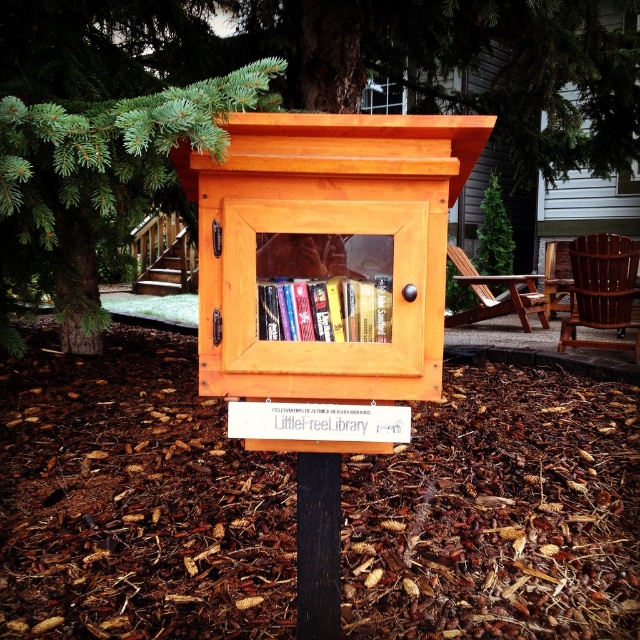
Looking at this image, can you confirm if green pine tree at upper center is smaller than hardcover books at center?

Actually, green pine tree at upper center might be larger than hardcover books at center.

Does green pine tree at upper center appear under hardcover books at center?

Actually, green pine tree at upper center is above hardcover books at center.

At what (x,y) coordinates should I click in order to perform the action: click on green pine tree at upper center. Please return your answer as a coordinate pair (x, y). Looking at the image, I should click on (266, 100).

This screenshot has height=640, width=640. Find the location of `green pine tree at upper center`. green pine tree at upper center is located at coordinates (266, 100).

Between green pine tree at upper center and black wood post at center, which one appears on the left side from the viewer's perspective?

black wood post at center

Which is behind, point (417, 19) or point (308, 532)?

Point (417, 19)

Which is behind, point (193, 29) or point (305, 490)?

Point (193, 29)

Locate an element on the screen. The width and height of the screenshot is (640, 640). green pine tree at upper center is located at coordinates (266, 100).

Can you confirm if hardcover books at center is positioned below black wood post at center?

No.

Measure the distance between hardcover books at center and camera.

4.28 feet

Where is `hardcover books at center`? The width and height of the screenshot is (640, 640). hardcover books at center is located at coordinates (324, 308).